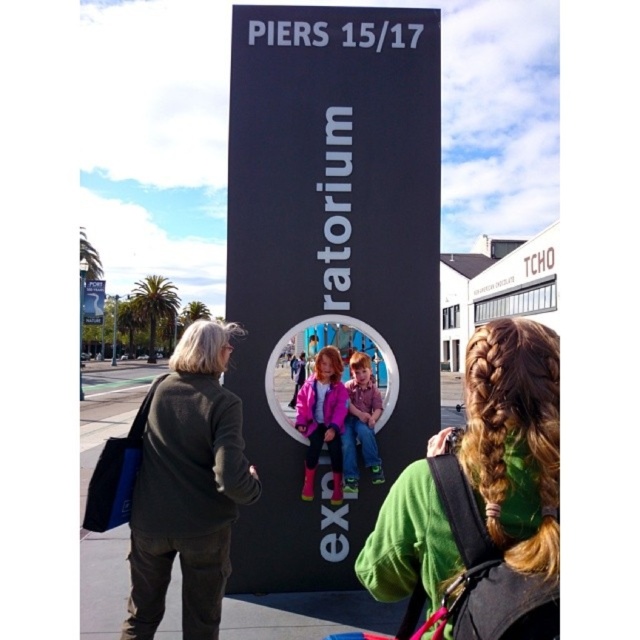
You are standing at the point with coordinates point (372, 445) and want to walk towards the point with coordinates point (368, 67). Will the sign with the text PIERS 1517 and exploratorium block your path?

Point (368, 67) is behind point (372, 445), so the sign will block your path to the point (368, 67) because it is located between you and the destination.